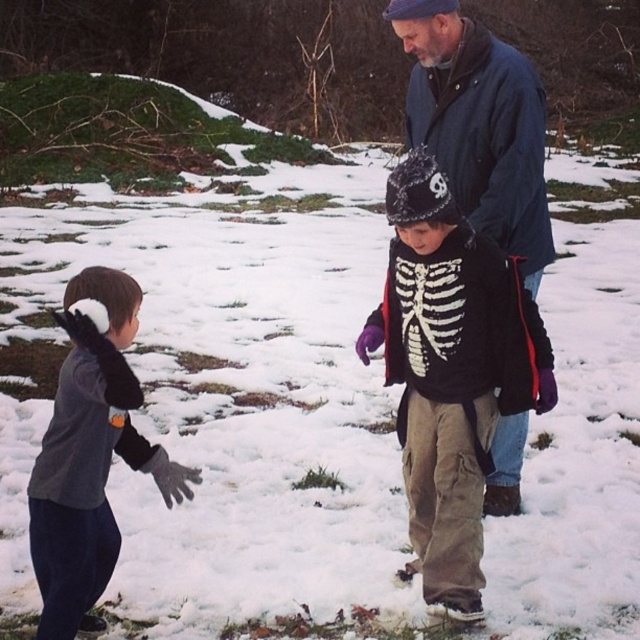
You are a photographer trying to capture a candid shot of the two children in the snowy scene. You want to ensure both the black cotton sweater with skeleton design at center and the gray fleece shirt at left are clearly visible in the frame. Based on their positions, which child should you focus on first to ensure both are in focus?

You should focus on the gray fleece shirt at left first because it is behind the black cotton sweater with skeleton design at center, so focusing on the closer subject might not keep both in focus. By focusing on the farther child, you can ensure both are within the depth of field.

Looking at this image, you are a photographer trying to capture a group photo of the black cotton sweater with skeleton design at center and the gray fleece shirt at left. To ensure both subjects are in the frame, should you position yourself to the left or right of the two subjects?

You should position yourself to the left of the two subjects because the gray fleece shirt at left is on the left side, and the black cotton sweater with skeleton design at center is to the right of it. This way, both subjects will be visible in the frame when you stand to the left.

You are a photographer trying to capture a candid shot of the two children in the snowy scene. You want to ensure that both the black cotton sweater with skeleton design at center and the gray fleece shirt at left are clearly visible in the frame. Given their heights, which child should you focus on first to ensure proper focus and composition?

The black cotton sweater with skeleton design at center is taller than the gray fleece shirt at left. Therefore, you should focus on the child wearing the black cotton sweater with skeleton design at center first to ensure proper focus and composition.